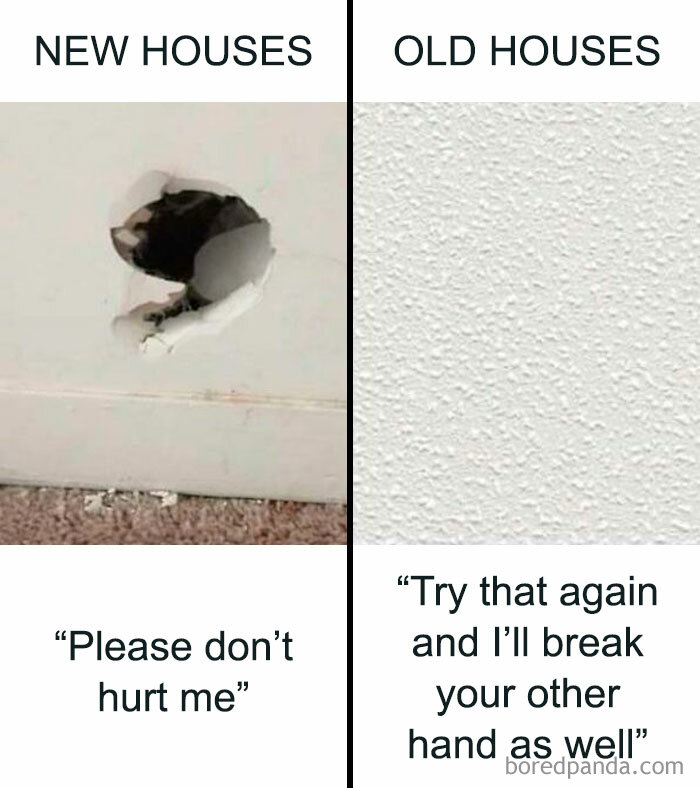
In order to click on bent in pieces of drywall in this screenshot , I will do `click(150, 192)`, `click(178, 181)`, `click(134, 321)`, `click(241, 305)`, `click(239, 262)`, `click(162, 336)`, `click(127, 236)`.